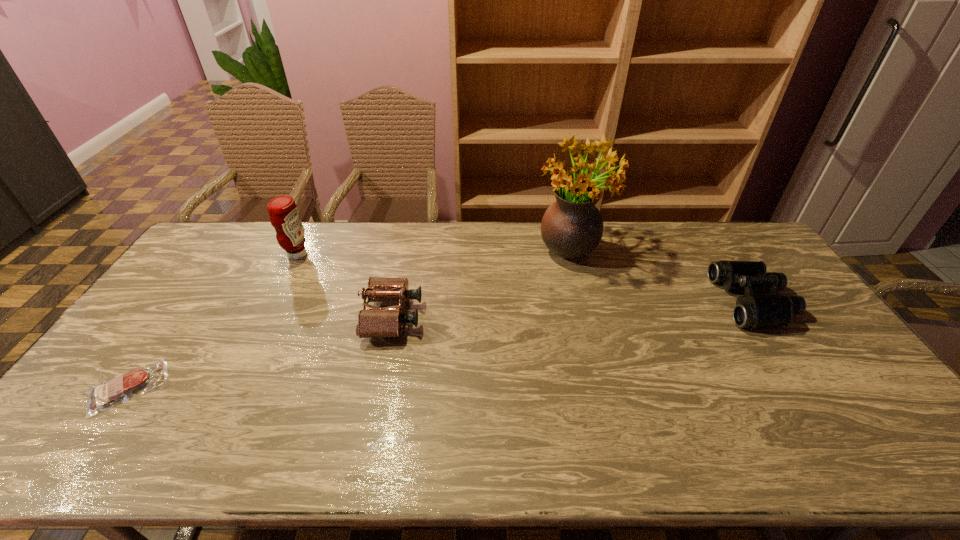
This screenshot has width=960, height=540. I want to click on vacant space that is in between the condiment and the tallest object, so click(x=435, y=251).

The height and width of the screenshot is (540, 960). What are the coordinates of `vacant area between the left binoculars and the steak` in the screenshot? It's located at (260, 352).

Where is `empty location between the steak and the flower arrangement`? The width and height of the screenshot is (960, 540). empty location between the steak and the flower arrangement is located at coordinates (350, 317).

Find the location of a particular element. This screenshot has height=540, width=960. free space between the left binoculars and the fourth object from left to right is located at coordinates (482, 282).

Where is `vacant point located between the right binoculars and the tallest object`? vacant point located between the right binoculars and the tallest object is located at coordinates coord(662,274).

Locate which object is the second closest to the rightmost object. Please provide its 2D coordinates. Your answer should be formatted as a tuple, i.e. [(x, y)], where the tuple contains the x and y coordinates of a point satisfying the conditions above.

[(386, 322)]

Identify which object is the third nearest to the flower arrangement. Please provide its 2D coordinates. Your answer should be formatted as a tuple, i.e. [(x, y)], where the tuple contains the x and y coordinates of a point satisfying the conditions above.

[(284, 216)]